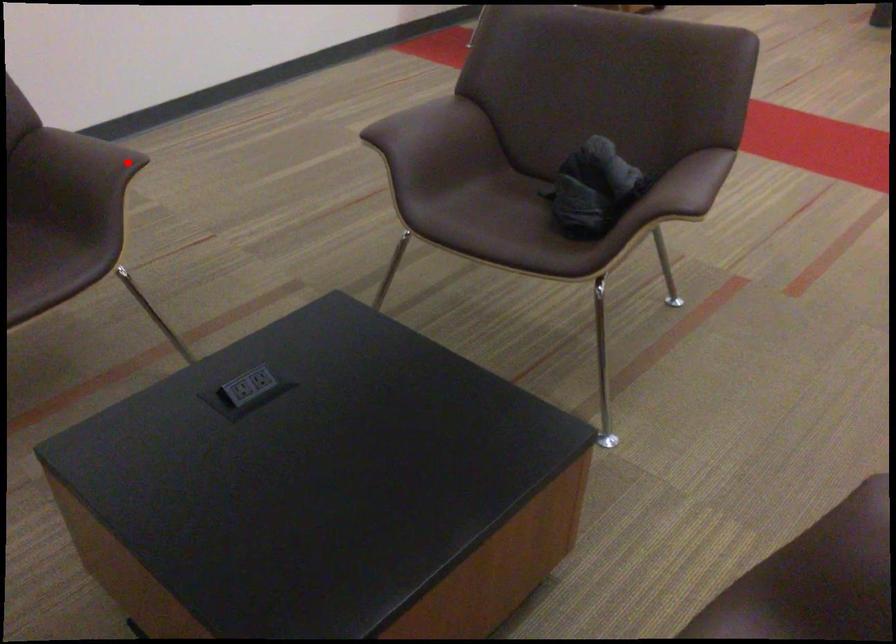
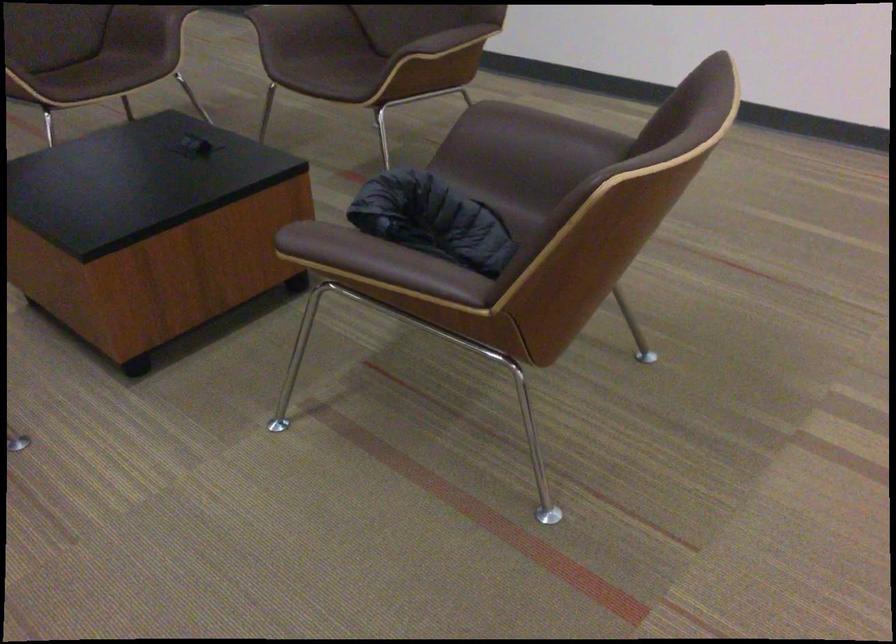
Question: I am providing you with two images of the same scene from different viewpoints. Given a red point in image1, look at the same physical point in image2. Is it:

Choices:
 (A) Closer to the viewpoint
 (B) Farther from the viewpoint

Answer: (B)